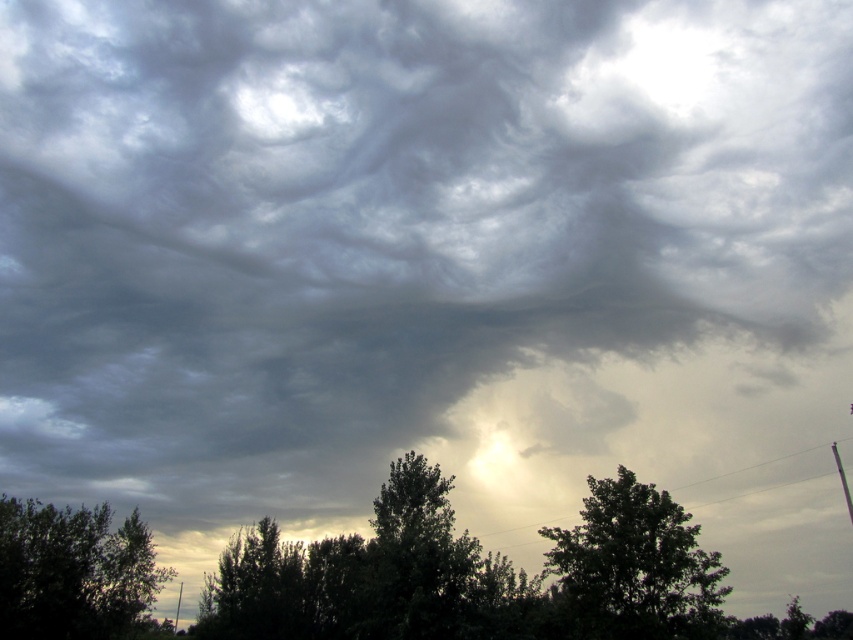
Is green leafy tree at upper center to the right of dark green leafy tree at lower left from the viewer's perspective?

Yes, green leafy tree at upper center is to the right of dark green leafy tree at lower left.

Consider the image. Who is higher up, green leafy tree at upper center or dark green leafy tree at lower left?

green leafy tree at upper center is higher up.

Between point (589, 500) and point (151, 566), which one is positioned in front?

Point (589, 500) is in front.

Locate an element on the screen. This screenshot has width=853, height=640. green leafy tree at upper center is located at coordinates (634, 566).

Between green leafy tree at upper center and dark green leafy tree at center, which one has less height?

green leafy tree at upper center is shorter.

Between green leafy tree at upper center and dark green leafy tree at center, which one is positioned higher?

green leafy tree at upper center is above.

Does point (625, 528) come farther from viewer compared to point (445, 566)?

No, (625, 528) is closer to viewer.

Image resolution: width=853 pixels, height=640 pixels. In order to click on green leafy tree at upper center in this screenshot , I will do `click(634, 566)`.

Is dark green leafy tree at lower left in front of dark green leafy tree at center?

No, it is behind dark green leafy tree at center.

Which is below, dark green leafy tree at lower left or dark green leafy tree at center?

Positioned lower is dark green leafy tree at lower left.

Locate an element on the screen. Image resolution: width=853 pixels, height=640 pixels. dark green leafy tree at lower left is located at coordinates (73, 572).